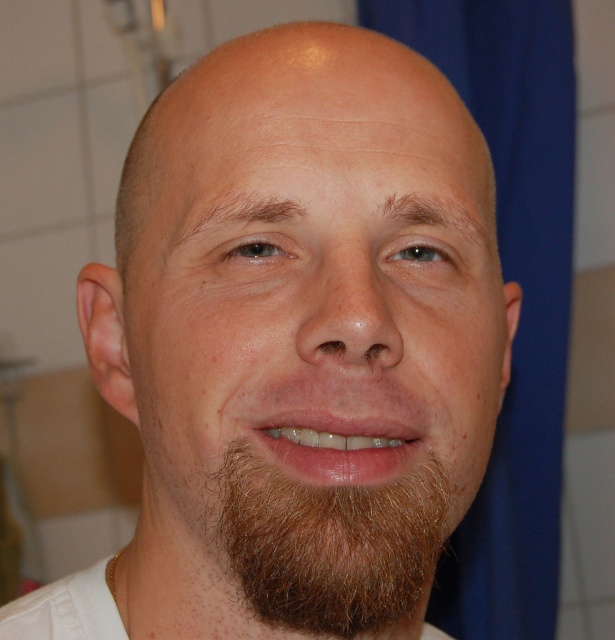
Looking at the person in the image, where is the brown matte beard at center in relation to the brown fuzzy beard at lower center?

The brown matte beard at center is located to the left of the brown fuzzy beard at lower center.

You are a photographer trying to capture a close portrait. You notice the brown matte beard at center and the brown fuzzy beard at lower center. Which beard takes up more space in the photo?

The brown matte beard at center takes up more space in the photo because it is larger in size than the brown fuzzy beard at lower center.

Looking at the person in the image, which part of their beard is wider, the brown matte beard at center or the brown fuzzy beard at lower center?

The brown matte beard at center is wider than the brown fuzzy beard at lower center according to the description.